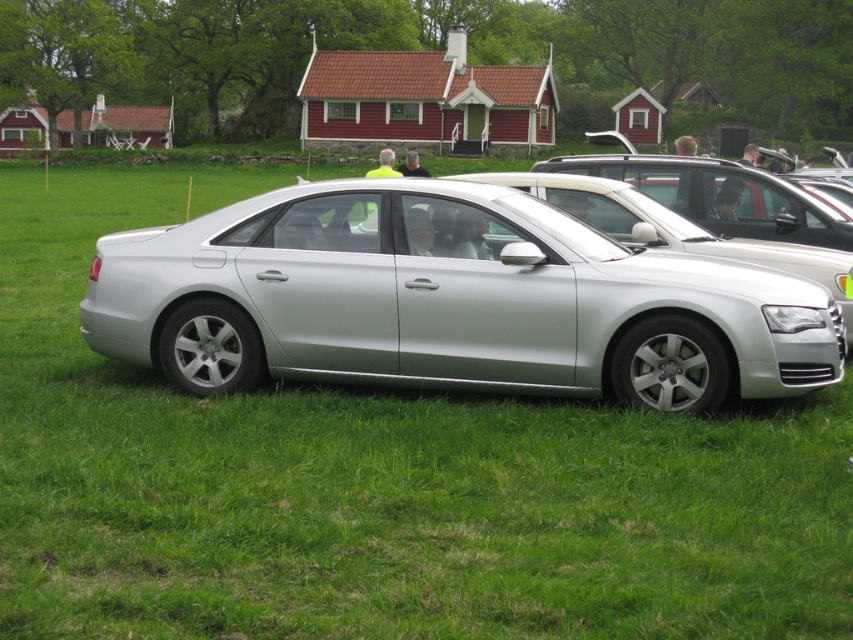
Describe the element at coordinates (450, 301) in the screenshot. I see `silver metallic sedan at center` at that location.

Can you confirm if silver metallic sedan at center is bigger than satin silver car at center?

Yes, silver metallic sedan at center is bigger than satin silver car at center.

Does point (579, 284) come farther from viewer compared to point (782, 268)?

No, (579, 284) is in front of (782, 268).

At what (x,y) coordinates should I click in order to perform the action: click on silver metallic sedan at center. Please return your answer as a coordinate pair (x, y). The image size is (853, 640). Looking at the image, I should click on (450, 301).